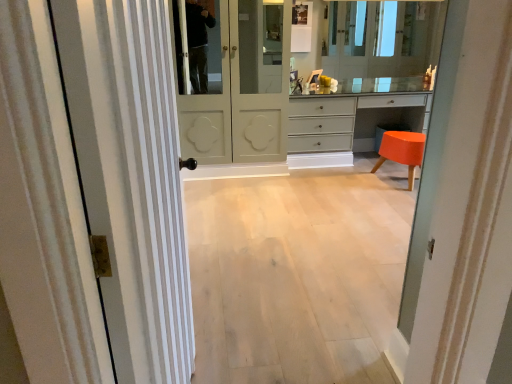
Image resolution: width=512 pixels, height=384 pixels. Identify the location of free space in front of matte white door at center, which is the second door from front to back. (245, 194).